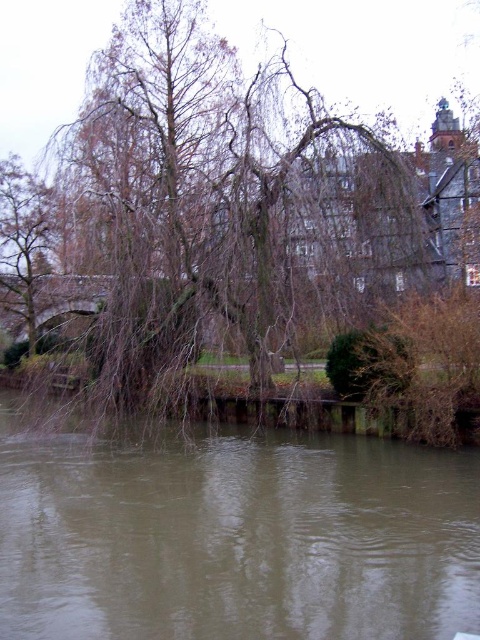
You are standing at the riverside and see the brown murky water at lower center and the brown textured tree at left. Which object takes up more space in the image?

The brown textured tree at left takes up more space in the image compared to the brown murky water at lower center, as the water has a smaller size.